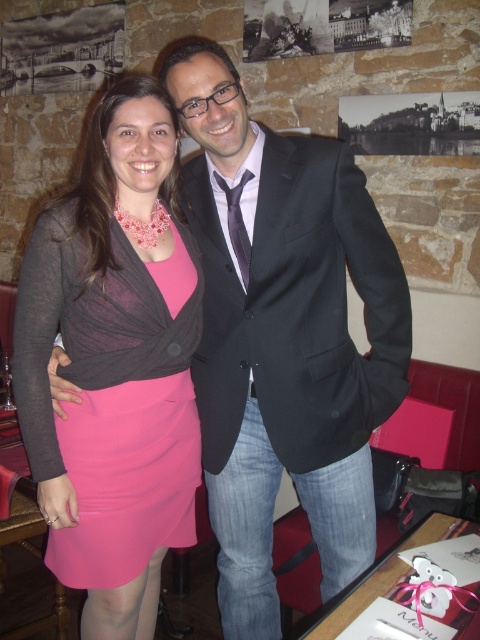
Who is higher up, pink satin dress at center or black smooth suit at center?

Positioned higher is black smooth suit at center.

Who is taller, pink satin dress at center or black smooth suit at center?

pink satin dress at center is taller.

Measure the distance between point (61,296) and camera.

The distance of point (61,296) from camera is 1.37 meters.

The height and width of the screenshot is (640, 480). In order to click on pink satin dress at center in this screenshot , I will do `click(113, 364)`.